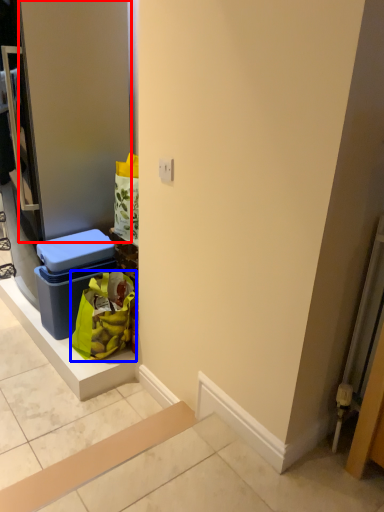
Question: Which point is further to the camera, door (highlighted by a red box) or shopping bag (highlighted by a blue box)?

Choices:
 (A) door
 (B) shopping bag

Answer: (B)